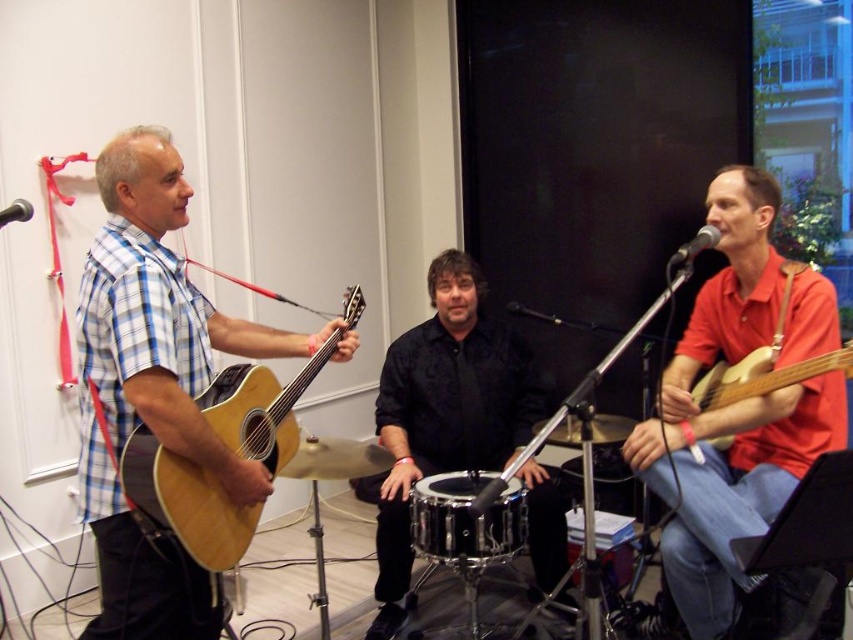
Question: Considering the real-world distances, which object is farthest from the wooden acoustic guitar at right?

Choices:
 (A) matte red guitar at right
 (B) wooden acoustic guitar at left
 (C) black metallic microphone at upper left

Answer: (C)

Question: Can you confirm if black metallic drum at center is smaller than black metallic microphone at upper left?

Choices:
 (A) yes
 (B) no

Answer: (B)

Question: Does black metallic drum at center lie behind black metallic microphone at upper left?

Choices:
 (A) no
 (B) yes

Answer: (B)

Question: Does black drum at center appear over black metallic microphone at upper left?

Choices:
 (A) no
 (B) yes

Answer: (A)

Question: Which of the following is the farthest from the observer?

Choices:
 (A) wooden acoustic guitar at left
 (B) black metallic microphone at upper right
 (C) matte plaid shirt at left

Answer: (B)

Question: Which object is positioned closest to the matte plaid shirt at left?

Choices:
 (A) matte red guitar at right
 (B) wooden acoustic guitar at right
 (C) black metallic microphone at upper right
 (D) black metallic drum at center

Answer: (D)